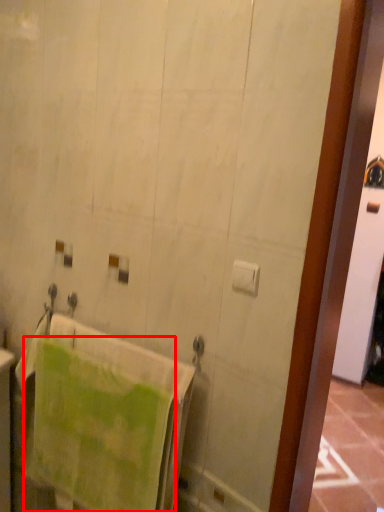
Question: In this image, where is towel (annotated by the red box) located relative to toilet paper?

Choices:
 (A) right
 (B) left

Answer: (B)